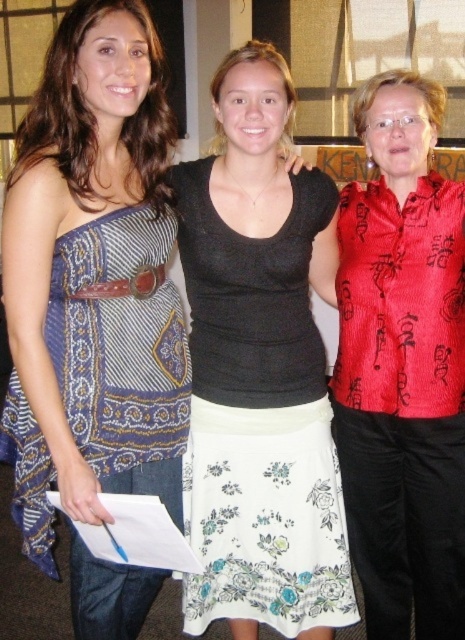
Is red corduroy vest at center taller than blue printed fabric dress at left?

Yes, red corduroy vest at center is taller than blue printed fabric dress at left.

Which is in front, point (417, 100) or point (123, 252)?

Point (123, 252)

Locate an element on the screen. This screenshot has width=465, height=640. red corduroy vest at center is located at coordinates (403, 365).

Locate an element on the screen. The width and height of the screenshot is (465, 640). red corduroy vest at center is located at coordinates (403, 365).

Is red corduroy vest at center thinner than white floral skirt at center?

Yes, red corduroy vest at center is thinner than white floral skirt at center.

Between point (367, 628) and point (301, 488), which one is positioned in front?

Positioned in front is point (301, 488).

Find the location of `red corduroy vest at center`. red corduroy vest at center is located at coordinates (403, 365).

Does white floral skirt at center appear on the left side of blue printed fabric dress at left?

Incorrect, white floral skirt at center is not on the left side of blue printed fabric dress at left.

Between point (210, 173) and point (121, 305), which one is positioned behind?

The point (210, 173) is behind.

Find the location of `white floral skirt at center`. white floral skirt at center is located at coordinates (259, 419).